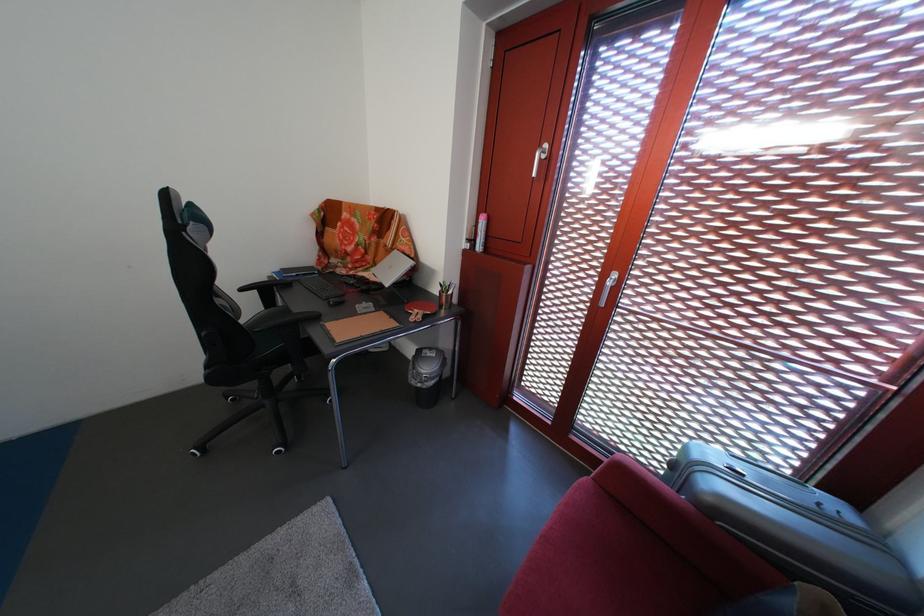
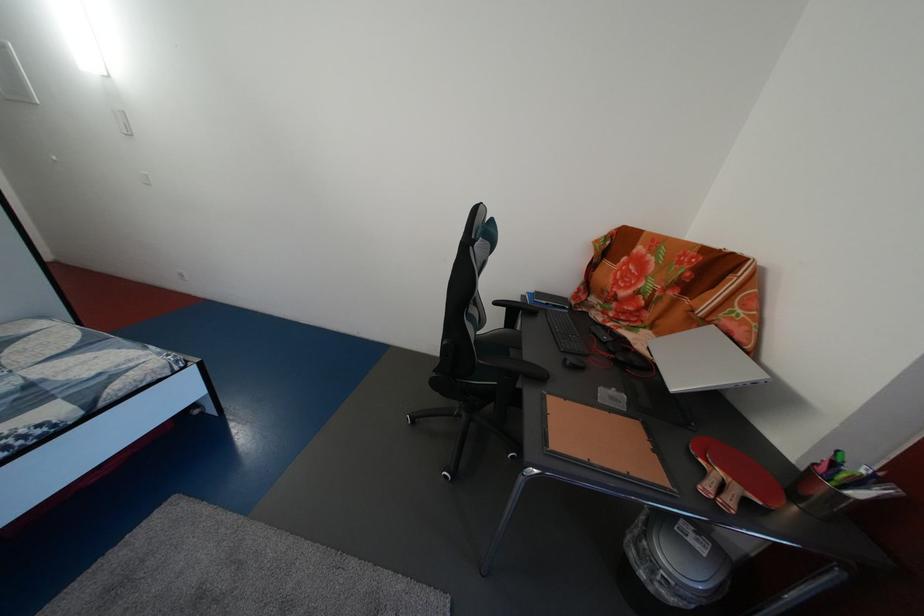
Question: The camera is either moving clockwise (left) or counter-clockwise (right) around the object. The first image is from the beginning of the video and the second image is from the end. Is the camera moving left or right when shooting the video?

Choices:
 (A) Left
 (B) Right

Answer: (B)